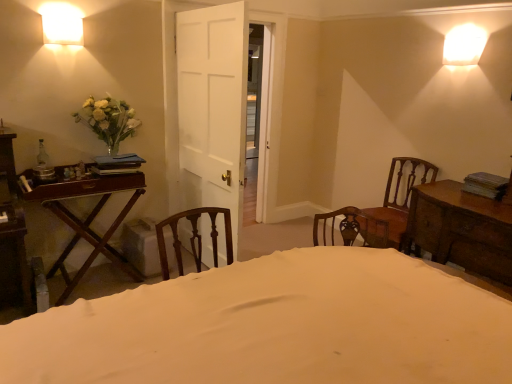
Question: Looking at their shapes, would you say white fabric bed at center is wider or thinner than wooden chest of drawers at right, the first table in the right-to-left sequence?

Choices:
 (A) wide
 (B) thin

Answer: (A)

Question: From the image's perspective, is white fabric bed at center above or below wooden chest of drawers at right, the first table in the right-to-left sequence?

Choices:
 (A) above
 (B) below

Answer: (B)

Question: Which is farther from the white matte vase at left?

Choices:
 (A) wooden chair at right
 (B) mahogany wood table at left, the 1th table when ordered from left to right
 (C) white glossy wall sconce at upper left
 (D) wooden chest of drawers at right, the first table in the right-to-left sequence
 (E) white fabric bed at center

Answer: (D)

Question: Which object is the closest to the white glossy wall sconce at upper left?

Choices:
 (A) white fabric bed at center
 (B) wooden chest of drawers at right, the second table from the left
 (C) mahogany wood table at left, the 1th table when ordered from left to right
 (D) wooden chair at right
 (E) white matte vase at left

Answer: (E)